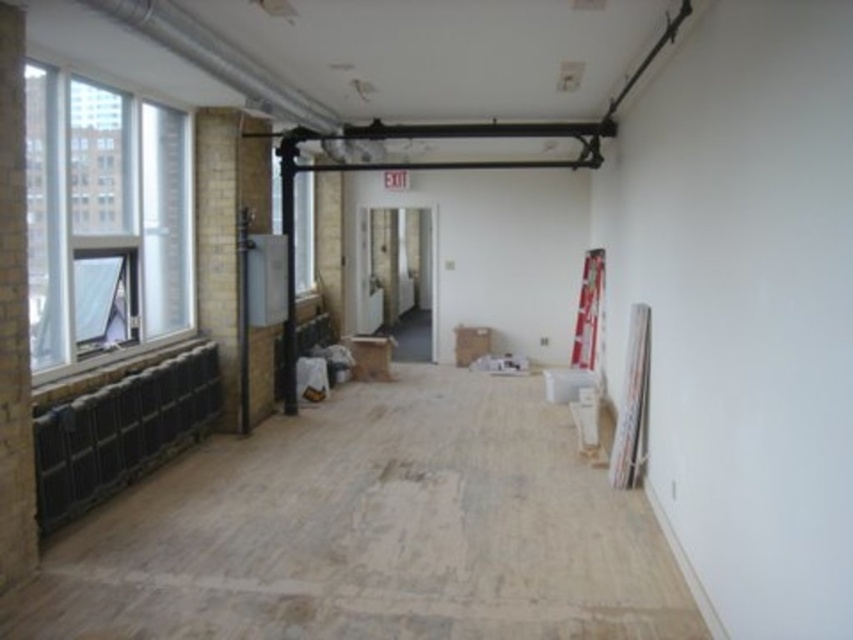
You are standing at the point marked as point (131, 252) in the room. You need to move to the other side of the room, which is 5.78 meters away. If your maximum walking distance is 6 meters, can you reach the other side without exceeding your limit?

Yes, you can reach the other side because the distance between point (131, 252) and the destination is 5.78 meters, which is within your 6 meter limit.

You are standing in the room and want to walk from point A to point B. Point A is at coordinate point (90, 90) and point B is at coordinate point (20, 355). Which point is closer to you when you first enter the room?

Point B at coordinate point (20, 355) is closer to you when you first enter the room because point A at coordinate point (90, 90) is further away from the camera.